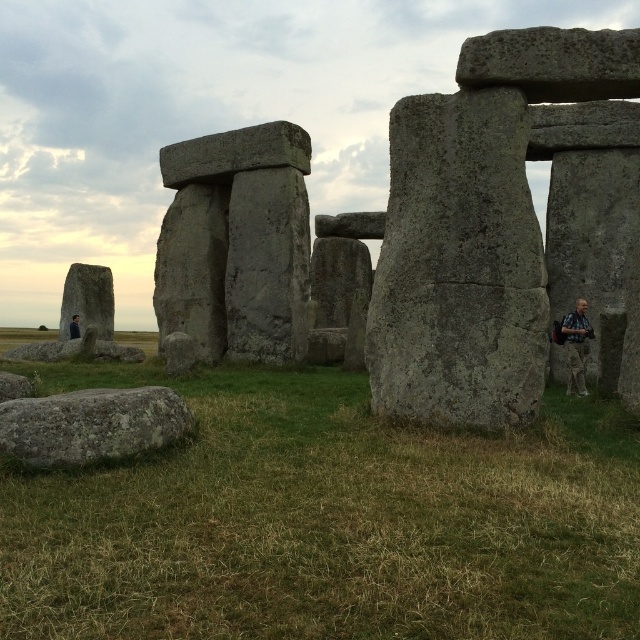
Question: Is gray stone monolith at center to the left of camouflage fabric jacket at lower right from the viewer's perspective?

Choices:
 (A) no
 (B) yes

Answer: (B)

Question: Among these objects, which one is farthest from the camera?

Choices:
 (A) gray stone structure at center
 (B) green grass at center
 (C) camouflage fabric jacket at lower right

Answer: (C)

Question: Does gray rough boulder at lower left have a smaller size compared to dark blue shirt at lower left?

Choices:
 (A) yes
 (B) no

Answer: (B)

Question: Which point is closer to the camera?

Choices:
 (A) green grass at center
 (B) gray rough boulder at lower left
 (C) dark blue shirt at lower left
 (D) gray stone structure at center

Answer: (A)

Question: Does gray stone structure at center have a larger size compared to camouflage fabric jacket at lower right?

Choices:
 (A) no
 (B) yes

Answer: (B)

Question: Which point appears closest to the camera in this image?

Choices:
 (A) (77, 452)
 (B) (493, 236)
 (C) (76, 321)
 (D) (58, 381)

Answer: (A)